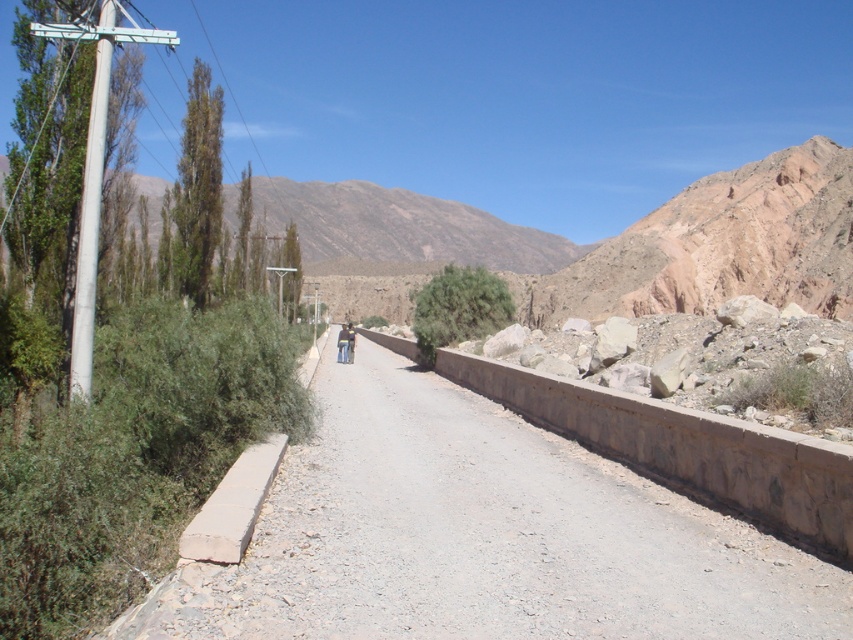
Question: Which point appears closest to the camera in this image?

Choices:
 (A) (84, 257)
 (B) (494, 465)
 (C) (97, 32)
 (D) (345, 332)

Answer: (A)

Question: From the image, what is the correct spatial relationship of dusty gravel road at center in relation to white plastic street sign at upper left?

Choices:
 (A) above
 (B) below

Answer: (B)

Question: Which point is farther from the camera taking this photo?

Choices:
 (A) (347, 332)
 (B) (97, 209)
 (C) (340, 353)

Answer: (A)

Question: Based on their relative distances, which object is nearer to the dusty gravel road at center?

Choices:
 (A) brown leather jacket at center
 (B) white metallic pole at left

Answer: (B)

Question: Does white metallic pole at left appear on the left side of white plastic street sign at upper left?

Choices:
 (A) yes
 (B) no

Answer: (B)

Question: Does brown leather jacket at center have a smaller size compared to dark blue jeans at center?

Choices:
 (A) no
 (B) yes

Answer: (B)